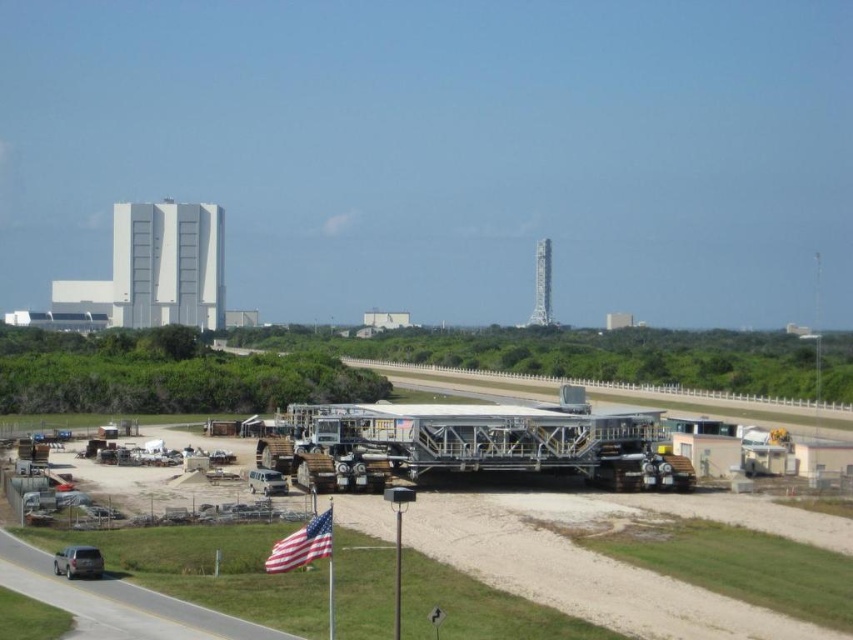
Is gray asphalt highway at lower left positioned in front of american flag at lower center?

No, gray asphalt highway at lower left is further to the viewer.

Who is positioned more to the left, gray asphalt highway at lower left or american flag at lower center?

gray asphalt highway at lower left

Measure the distance between gray asphalt highway at lower left and camera.

gray asphalt highway at lower left and camera are 164.85 feet apart.

This screenshot has width=853, height=640. In order to click on gray asphalt highway at lower left in this screenshot , I will do pyautogui.click(x=178, y=611).

Is gray asphalt highway at lower left further to the viewer compared to sandy beige van at center?

No, it is in front of sandy beige van at center.

Who is lower down, gray asphalt highway at lower left or sandy beige van at center?

gray asphalt highway at lower left

Measure the distance between point (x=172, y=602) and camera.

They are 58.57 meters apart.

Locate an element on the screen. Image resolution: width=853 pixels, height=640 pixels. gray asphalt highway at lower left is located at coordinates (178, 611).

Is metallic silver trailer truck at center smaller than sandy beige van at center?

Actually, metallic silver trailer truck at center might be larger than sandy beige van at center.

Which is more to the right, metallic silver trailer truck at center or sandy beige van at center?

metallic silver trailer truck at center

Does point (643, 456) lie behind point (270, 470)?

Yes, point (643, 456) is behind point (270, 470).

The width and height of the screenshot is (853, 640). In order to click on metallic silver trailer truck at center in this screenshot , I will do `click(469, 444)`.